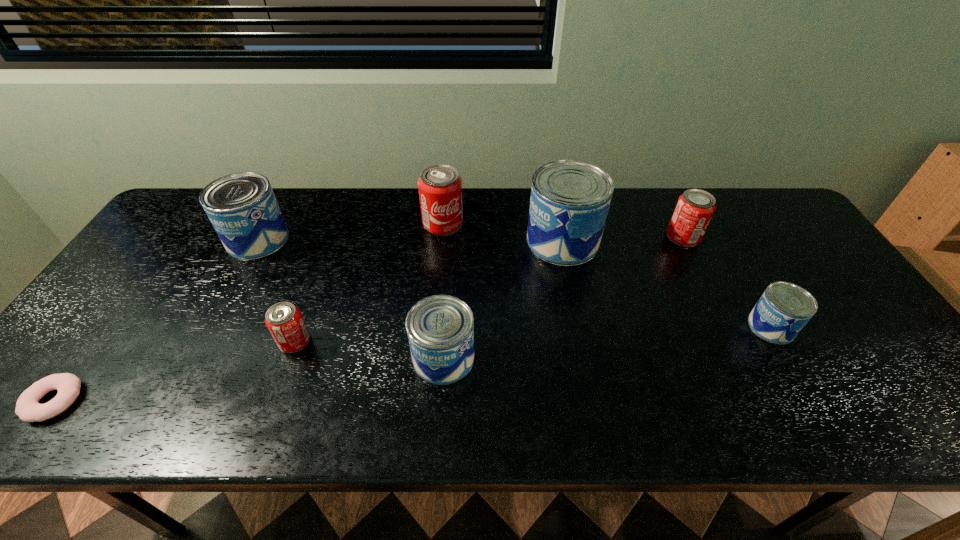
Where is `free space between the rightmost red can and the nearest red can`? Image resolution: width=960 pixels, height=540 pixels. free space between the rightmost red can and the nearest red can is located at coordinates (489, 289).

Where is `free space between the third blue can from right to left and the second smallest red can`? This screenshot has width=960, height=540. free space between the third blue can from right to left and the second smallest red can is located at coordinates (564, 298).

Where is `vacant area between the second smallest blue can and the smallest blue can`? vacant area between the second smallest blue can and the smallest blue can is located at coordinates (607, 342).

Find the location of `free spot between the smallest red can and the rightmost can`. free spot between the smallest red can and the rightmost can is located at coordinates (533, 334).

Identify the location of free spot between the second can from left to right and the second smallest blue can. The width and height of the screenshot is (960, 540). (369, 349).

Locate an element on the screen. the fourth closest object to the second smallest blue can is located at coordinates (242, 207).

Point out which object is positioned as the nearest to the doughnut. Please provide its 2D coordinates. Your answer should be formatted as a tuple, i.e. [(x, y)], where the tuple contains the x and y coordinates of a point satisfying the conditions above.

[(284, 321)]

At what (x,y) coordinates should I click in order to perform the action: click on the second closest can to the rightmost object. Please return your answer as a coordinate pair (x, y). This screenshot has height=540, width=960. Looking at the image, I should click on (570, 199).

Select which can appears as the second closest to the second can from left to right. Please provide its 2D coordinates. Your answer should be formatted as a tuple, i.e. [(x, y)], where the tuple contains the x and y coordinates of a point satisfying the conditions above.

[(242, 207)]

Locate an element on the screen. This screenshot has width=960, height=540. the fourth closest blue can to the biggest red can is located at coordinates (784, 308).